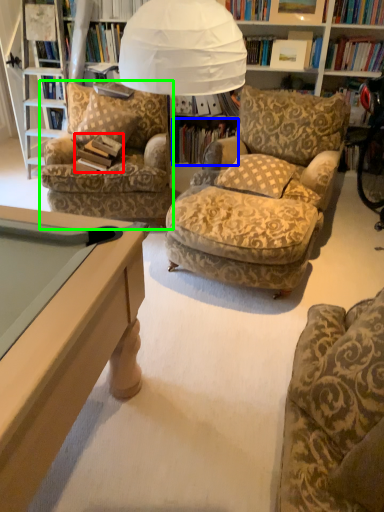
Question: Which is nearer to the book (highlighted by a red box)? book (highlighted by a blue box) or chair (highlighted by a green box).

Choices:
 (A) book
 (B) chair

Answer: (B)